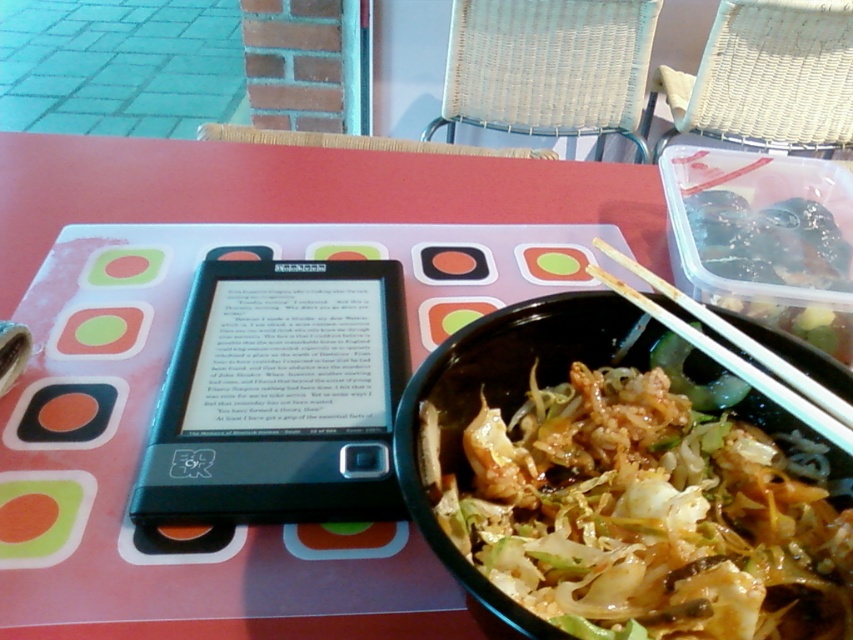
Question: Is black plastic e-reader at center smaller than black plastic bowl at lower right?

Choices:
 (A) yes
 (B) no

Answer: (A)

Question: Which object is closer to the camera taking this photo?

Choices:
 (A) black plastic bowl at lower right
 (B) black plastic e-reader at center

Answer: (A)

Question: Can you confirm if black plastic e-reader at center is positioned below black plastic bowl at lower right?

Choices:
 (A) no
 (B) yes

Answer: (A)

Question: Among these objects, which one is nearest to the camera?

Choices:
 (A) wooden chopsticks at bowl right
 (B) black plastic bowl at lower right

Answer: (B)

Question: Can you confirm if black plastic e-reader at center is positioned to the left of wooden chopsticks at bowl right?

Choices:
 (A) no
 (B) yes

Answer: (B)

Question: Which of the following is the farthest from the observer?

Choices:
 (A) black plastic e-reader at center
 (B) black plastic bowl at lower right

Answer: (A)